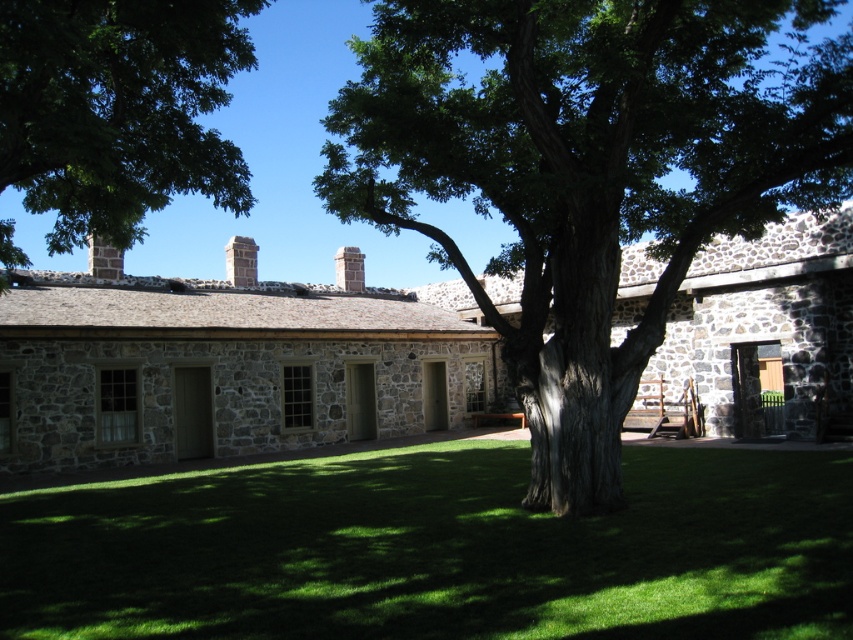
Question: Which object is the farthest from the green grass at center?

Choices:
 (A) green leafy tree at upper center
 (B) green leafy tree at center
 (C) smooth stone chimney at center

Answer: (C)

Question: Which object is farther from the camera taking this photo?

Choices:
 (A) green leafy tree at center
 (B) green leafy tree at upper center
 (C) green grass at center
 (D) smooth stone chimney at center

Answer: (D)

Question: Does brown stone chimney at center have a greater width compared to smooth stone chimney at center?

Choices:
 (A) no
 (B) yes

Answer: (B)

Question: Is green leafy tree at upper center above brown stone chimney at center?

Choices:
 (A) yes
 (B) no

Answer: (A)

Question: Is green leafy tree at upper center positioned at the back of smooth stone chimney at center?

Choices:
 (A) no
 (B) yes

Answer: (A)

Question: Which of these objects is positioned closest to the smooth stone chimney at upper center?

Choices:
 (A) smooth stone chimney at center
 (B) brown stone chimney at center

Answer: (B)